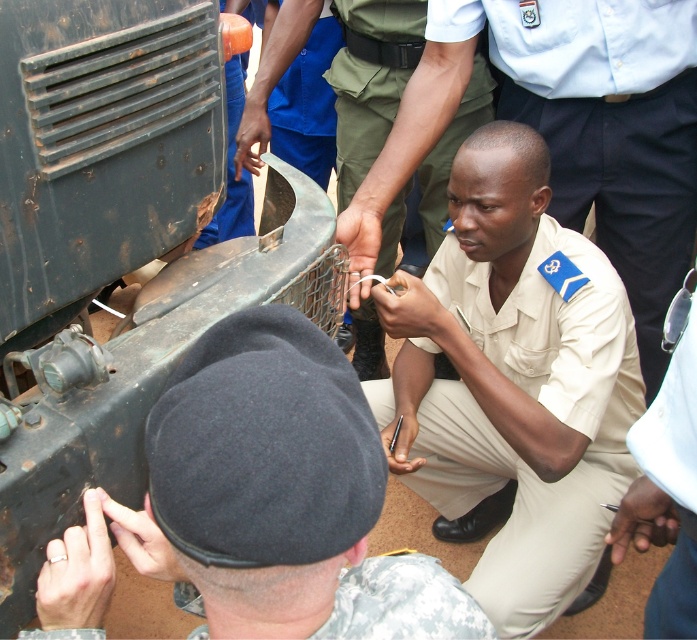
Question: Considering the real-world distances, which object is closest to the black felt beret at lower center?

Choices:
 (A) white fabric shirt at center
 (B) blue fabric pants at upper center
 (C) beige uniform at center
 (D) khaki fabric shirt at center

Answer: (A)

Question: Does beige uniform at center have a smaller size compared to blue fabric pants at upper center?

Choices:
 (A) no
 (B) yes

Answer: (A)

Question: Does white fabric shirt at center have a larger size compared to camouflage fabric beret at lower left?

Choices:
 (A) no
 (B) yes

Answer: (B)

Question: Which point is farther to the camera?

Choices:
 (A) (579, 420)
 (B) (408, 22)
 (C) (45, 634)

Answer: (B)

Question: Among these objects, which one is nearest to the camera?

Choices:
 (A) white fabric shirt at center
 (B) khaki fabric shirt at center
 (C) beige fabric shirt at center
 (D) black felt beret at lower center

Answer: (D)

Question: Can you confirm if khaki fabric shirt at center is thinner than blue fabric pants at upper center?

Choices:
 (A) no
 (B) yes

Answer: (A)